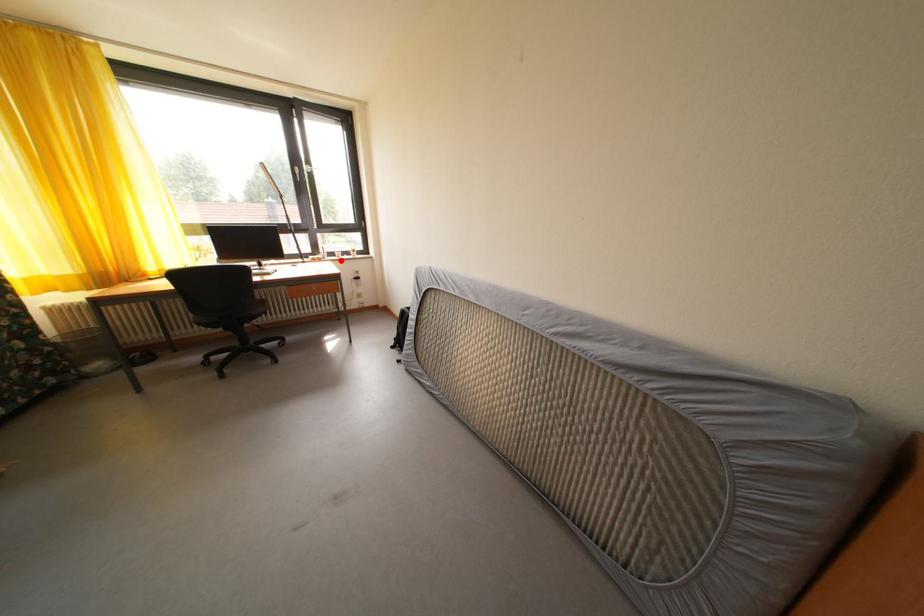
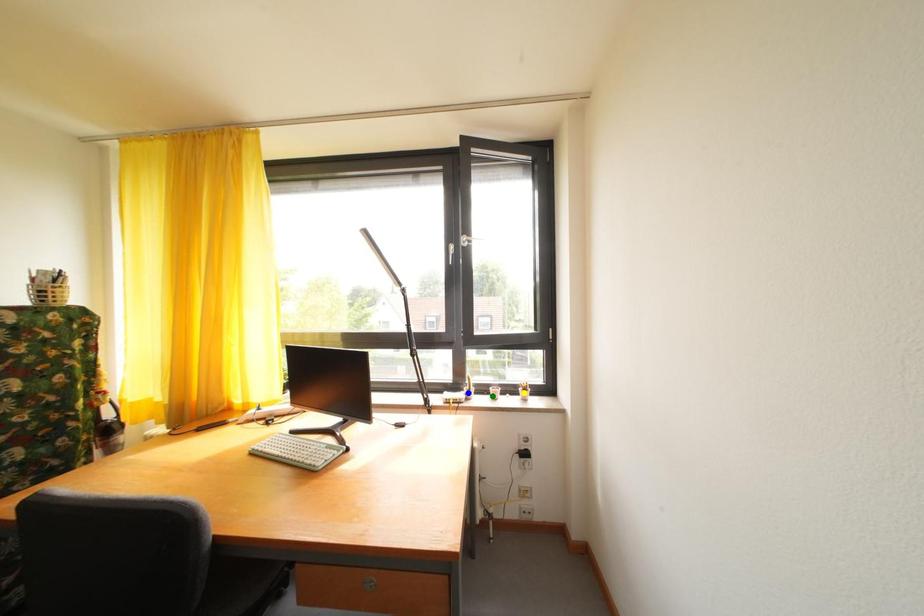
Question: I am providing you with two images of the same scene from different viewpoints. A red point is marked on the first image. You are given multiple points on the second image. Which point in image 2 is actually the same real-world point as the red point in image 1?

Choices:
 (A) yellow point
 (B) blue point
 (C) green point

Answer: (C)